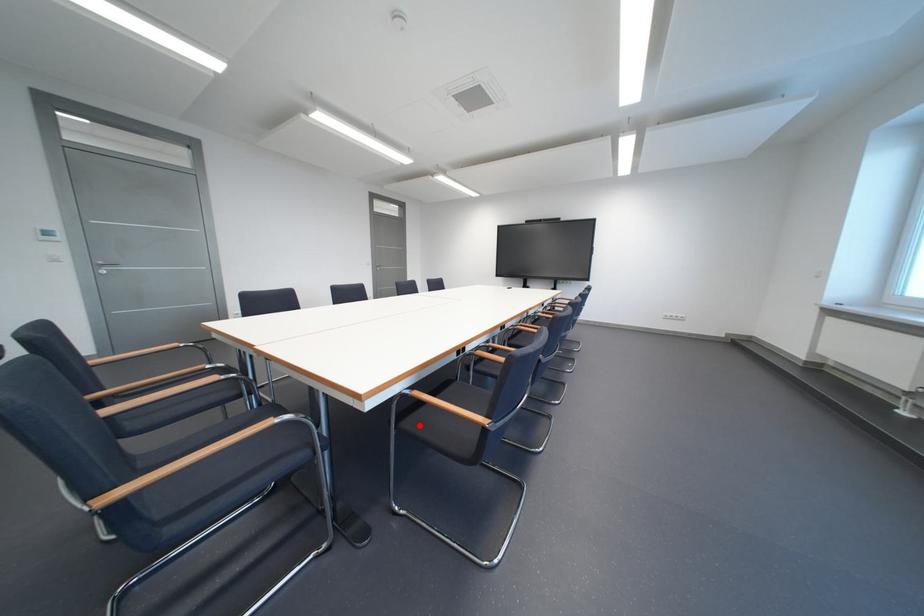
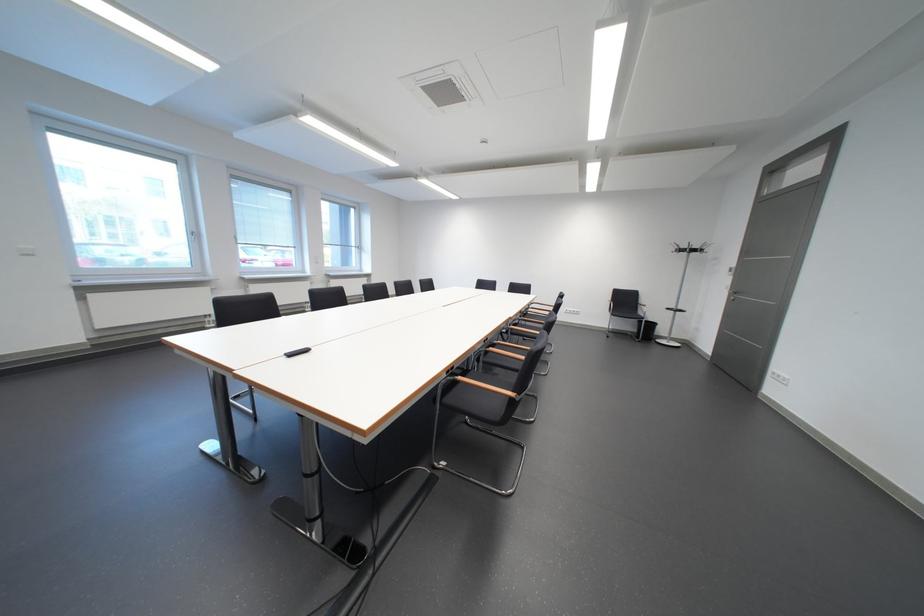
Question: I am providing you with two images of the same scene from different viewpoints. A red point is marked on the first image. Can you still see the location of the red point in image 2?

Choices:
 (A) Yes
 (B) No

Answer: (B)